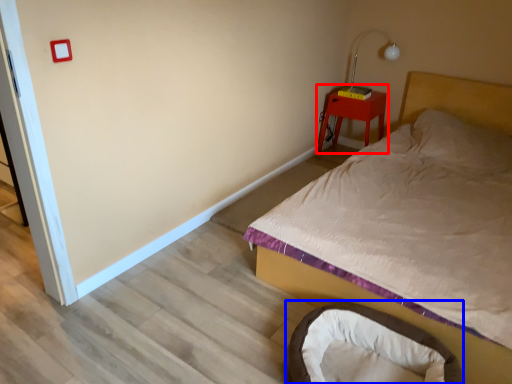
Question: Among these objects, which one is nearest to the camera, nightstand (highlighted by a red box) or infant bed (highlighted by a blue box)?

Choices:
 (A) nightstand
 (B) infant bed

Answer: (B)